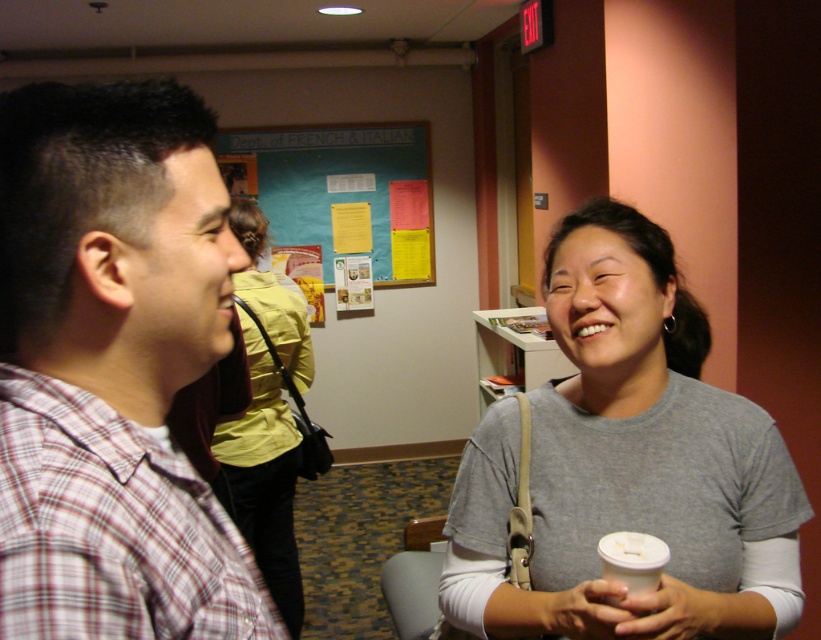
Is point (370, 241) in front of point (283, 492)?

No, (370, 241) is further to viewer.

Who is shorter, teal paperboard at upper center or matte yellow shirt at center?

teal paperboard at upper center

Identify the location of teal paperboard at upper center. This screenshot has height=640, width=821. (345, 189).

Is plaid shirt at left behind matte yellow shirt at center?

That is False.

Is plaid shirt at left shorter than matte yellow shirt at center?

Indeed, plaid shirt at left has a lesser height compared to matte yellow shirt at center.

Locate an element on the screen. plaid shirt at left is located at coordinates (112, 365).

Find the location of a particular element. plaid shirt at left is located at coordinates (112, 365).

Where is `plaid shirt at left`? plaid shirt at left is located at coordinates (112, 365).